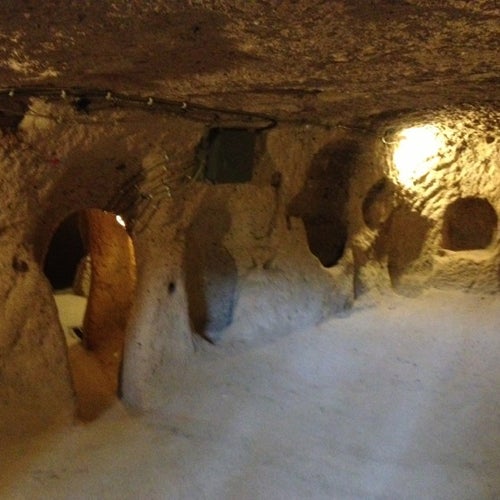
At what (x,y) coordinates should I click in order to perform the action: click on ceiling. Please return your answer as a coordinate pair (x, y). The image size is (500, 500). Looking at the image, I should click on (322, 57).